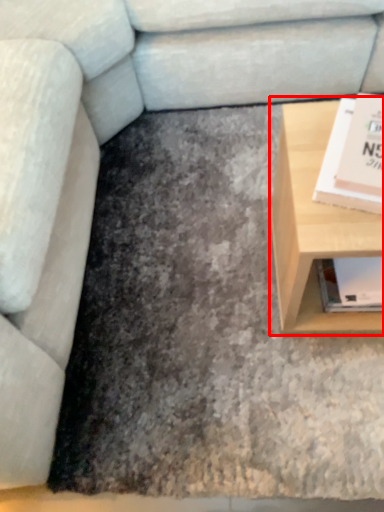
Question: From the image, what is the correct spatial relationship of table (annotated by the red box) in relation to paperback book?

Choices:
 (A) left
 (B) right

Answer: (A)